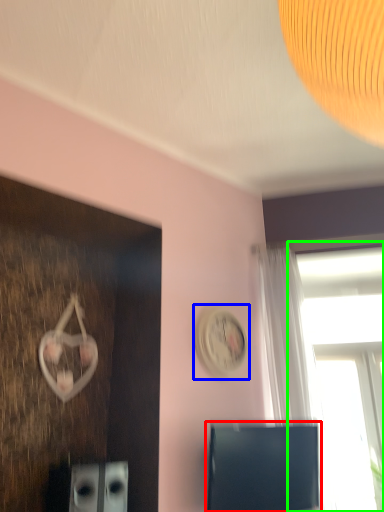
Question: Considering the real-world distances, which object is closest to computer monitor (highlighted by a red box)? clock (highlighted by a blue box) or window (highlighted by a green box).

Choices:
 (A) clock
 (B) window

Answer: (A)